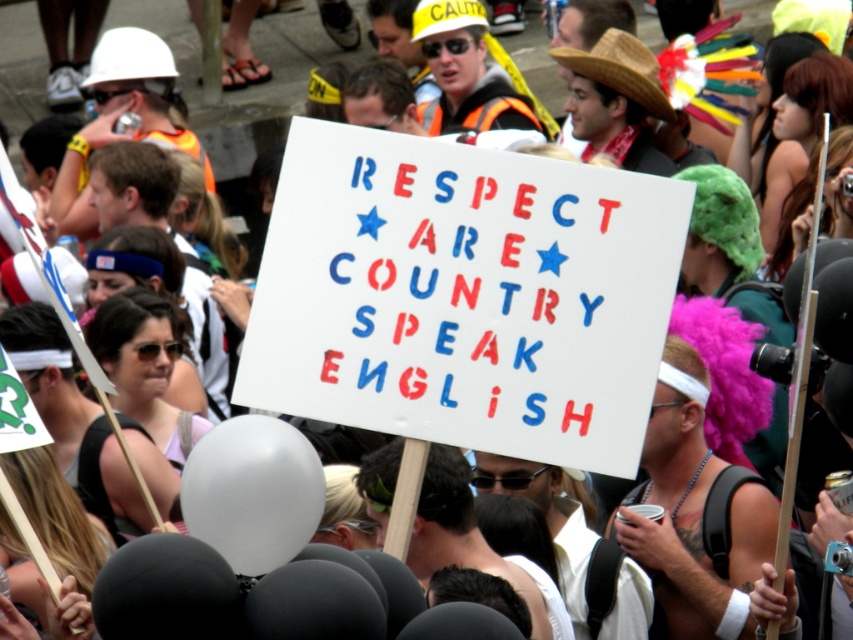
Can you confirm if white paper sign at center is smaller than white matte balloon at center?

Actually, white paper sign at center might be larger than white matte balloon at center.

Who is more distant from viewer, (579, 376) or (317, 483)?

The point (579, 376) is more distant.

The width and height of the screenshot is (853, 640). Find the location of `white paper sign at center`. white paper sign at center is located at coordinates (x=463, y=296).